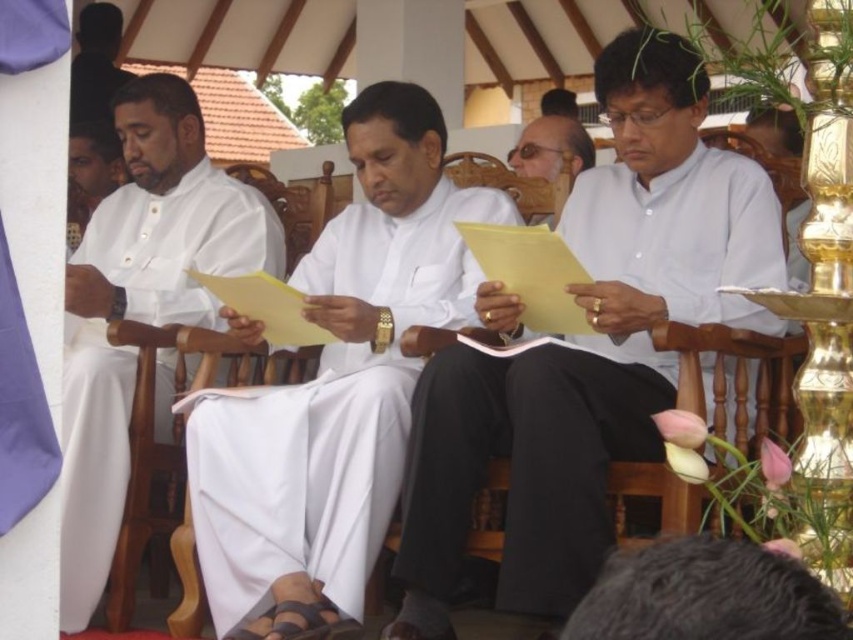
Question: Is white clothed man at left positioned in front of wooden chair at center?

Choices:
 (A) yes
 (B) no

Answer: (A)

Question: Which of the following is the closest to the observer?

Choices:
 (A) (763, 324)
 (B) (91, 314)
 (C) (547, 172)
 (D) (553, 211)

Answer: (A)

Question: Which of the following is the farthest from the observer?

Choices:
 (A) matte white paper at center
 (B) white matte shirt at center

Answer: (A)

Question: Among these objects, which one is farthest from the camera?

Choices:
 (A) white matte shirt at center
 (B) white cloth at center
 (C) wooden chair at center

Answer: (C)

Question: In this image, where is wooden chair at center located relative to matte white paper at center?

Choices:
 (A) right
 (B) left

Answer: (B)

Question: Does white matte shirt at center appear on the right side of matte white paper at center?

Choices:
 (A) yes
 (B) no

Answer: (B)